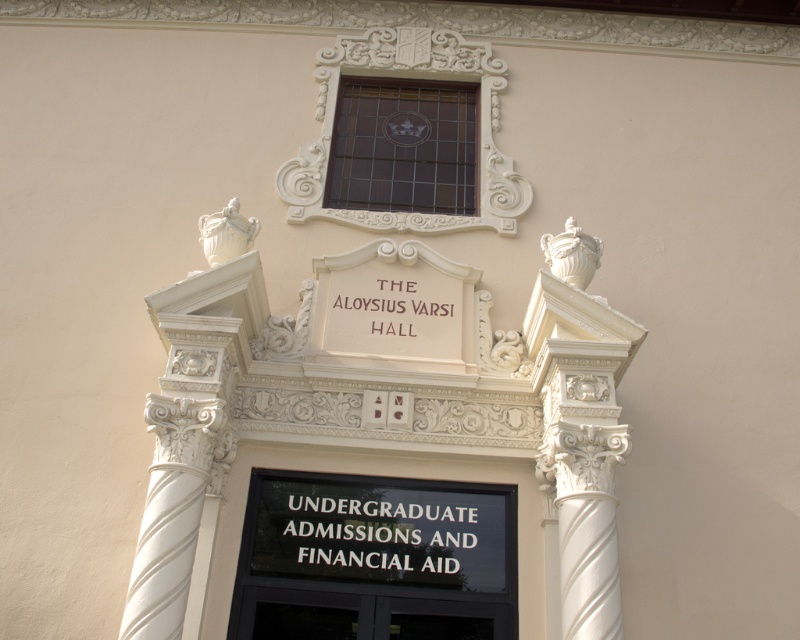
You are standing at the entrance of The Aloysius Varsi Hall and notice a black glass sign at center and a white marble column at right. Which object is positioned lower in the scene?

The black glass sign at center is positioned below the white marble column at right, so it is lower in the scene.

You are standing in front of the entrance of The Aloysius Varsi Hall. You need to locate the white marble column at right. Where should you look relative to the entrance?

The white marble column at right is located at the right side of the entrance, specifically at the coordinates point (584, 476).

You are standing at the point labeled point at (316, 554). You want to walk to the entrance of The Aloysius Varsi Hall. Which direction should you go?

The point at (316, 554) is 77.63 feet away from the entrance of The Aloysius Varsi Hall. You should walk towards the entrance, which is located at the bottom of the image since the point is at the top center.